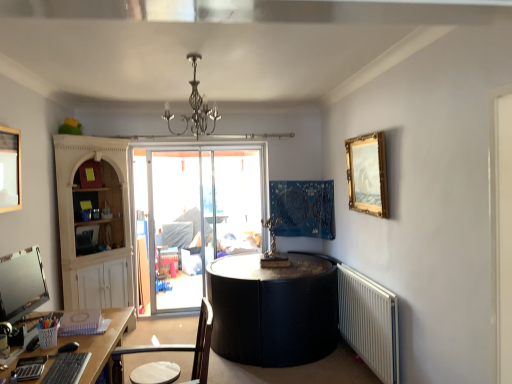
Question: From the image's perspective, would you say wooden picture frame at upper left, the second picture frame when ordered from back to front, is positioned over white plastic radiator at lower right?

Choices:
 (A) yes
 (B) no

Answer: (A)

Question: From a real-world perspective, is wooden picture frame at upper left, positioned as the second picture frame in right-to-left order, physically below white plastic radiator at lower right?

Choices:
 (A) no
 (B) yes

Answer: (A)

Question: Considering the relative sizes of wooden picture frame at upper left, acting as the 1th picture frame starting from the left, and white plastic radiator at lower right in the image provided, is wooden picture frame at upper left, acting as the 1th picture frame starting from the left, bigger than white plastic radiator at lower right?

Choices:
 (A) no
 (B) yes

Answer: (A)

Question: From the image's perspective, is wooden picture frame at upper left, acting as the first picture frame starting from the front, located beneath white plastic radiator at lower right?

Choices:
 (A) yes
 (B) no

Answer: (B)

Question: Is white plastic radiator at lower right surrounded by wooden picture frame at upper left, positioned as the second picture frame in right-to-left order?

Choices:
 (A) yes
 (B) no

Answer: (B)

Question: Does point (380, 140) appear closer or farther from the camera than point (390, 375)?

Choices:
 (A) farther
 (B) closer

Answer: (A)

Question: From the image's perspective, is gold/gilded picture frame at upper right, which ranks as the 1th picture frame in back-to-front order, above or below white plastic radiator at lower right?

Choices:
 (A) above
 (B) below

Answer: (A)

Question: Considering their positions, is gold/gilded picture frame at upper right, which is the first picture frame from right to left, located in front of or behind white plastic radiator at lower right?

Choices:
 (A) front
 (B) behind

Answer: (B)

Question: Choose the correct answer: Is gold/gilded picture frame at upper right, which is the first picture frame from right to left, inside white plastic radiator at lower right or outside it?

Choices:
 (A) inside
 (B) outside

Answer: (B)

Question: Would you say white plastic radiator at lower right is inside or outside matte black monitor at lower left?

Choices:
 (A) inside
 (B) outside

Answer: (B)

Question: Is white plastic radiator at lower right wider or thinner than matte black monitor at lower left?

Choices:
 (A) thin
 (B) wide

Answer: (A)

Question: From a real-world perspective, is white plastic radiator at lower right above or below matte black monitor at lower left?

Choices:
 (A) above
 (B) below

Answer: (B)

Question: Is white plastic radiator at lower right to the left or to the right of matte black monitor at lower left in the image?

Choices:
 (A) left
 (B) right

Answer: (B)

Question: Is wooden picture frame at upper left, acting as the first picture frame starting from the front, in front of or behind metallic chandelier at upper center in the image?

Choices:
 (A) front
 (B) behind

Answer: (B)

Question: From the image's perspective, relative to metallic chandelier at upper center, is wooden picture frame at upper left, positioned as the second picture frame in right-to-left order, above or below?

Choices:
 (A) above
 (B) below

Answer: (B)